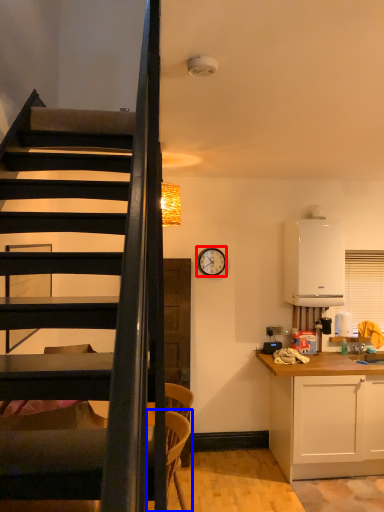
Question: Which of the following is the closest to the observer, clock (highlighted by a red box) or armchair (highlighted by a blue box)?

Choices:
 (A) clock
 (B) armchair

Answer: (B)